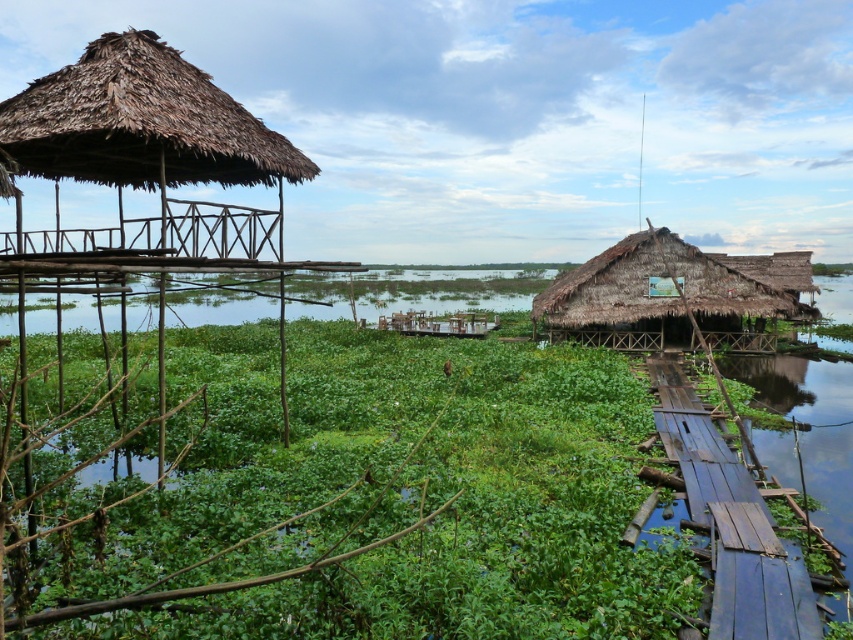
Question: Which is farther from the thatched bamboo hut at left?

Choices:
 (A) green leafy plants at center
 (B) thatched straw hut at right

Answer: (B)

Question: Does thatched bamboo hut at left have a greater width compared to thatched straw hut at right?

Choices:
 (A) yes
 (B) no

Answer: (B)

Question: Based on their relative distances, which object is farther from the green leafy plants at center?

Choices:
 (A) thatched bamboo hut at left
 (B) thatched straw hut at right

Answer: (B)

Question: Observing the image, what is the correct spatial positioning of green leafy plants at center in reference to thatched bamboo hut at left?

Choices:
 (A) below
 (B) above

Answer: (A)

Question: Observing the image, what is the correct spatial positioning of thatched bamboo hut at left in reference to thatched straw hut at right?

Choices:
 (A) above
 (B) below

Answer: (A)

Question: Which point appears closest to the camera in this image?

Choices:
 (A) (753, 285)
 (B) (561, 618)
 (C) (177, 81)

Answer: (B)